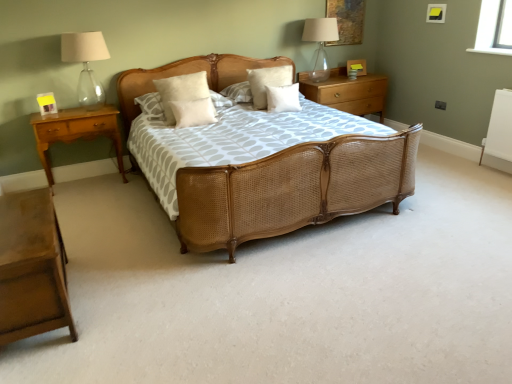
Locate an element on the screen. This screenshot has width=512, height=384. vacant area in front of woven wood bed at center is located at coordinates (284, 296).